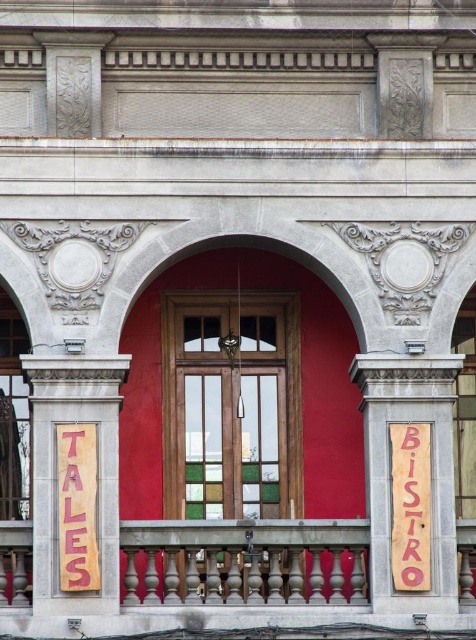
Based on the photo, you are standing at point A at point (86, 396) and want to walk to point B which is 76.34 meters away. Is there enough space to walk straight to point B without any obstacles?

Yes, there is enough space to walk straight to point B without any obstacles because the distance between them is 76.34 meters, which is a clear path.

You are standing in front of the building and notice two signs at the center of the doorway. Which sign is closer to you, the pink cardboard sign at center or the wooden sign at center?

The pink cardboard sign at center is closer to you because it is in front of the wooden sign at center.

You are a delivery person trying to read the signs on the door. The pink cardboard sign at center and wooden sign at center are both in your line of sight. Which one appears wider to you?

The pink cardboard sign at center appears wider because its width is larger than the wooden sign at center.